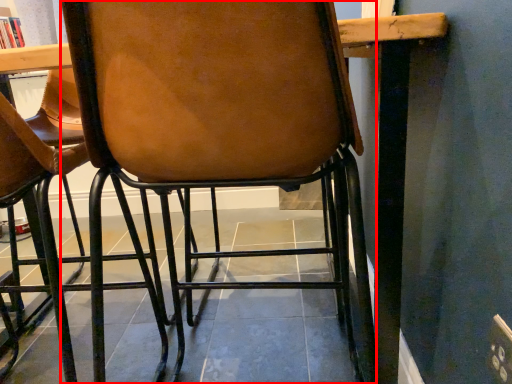
Question: Observing the image, what is the correct spatial positioning of chair (annotated by the red box) in reference to curtain?

Choices:
 (A) right
 (B) left

Answer: (A)